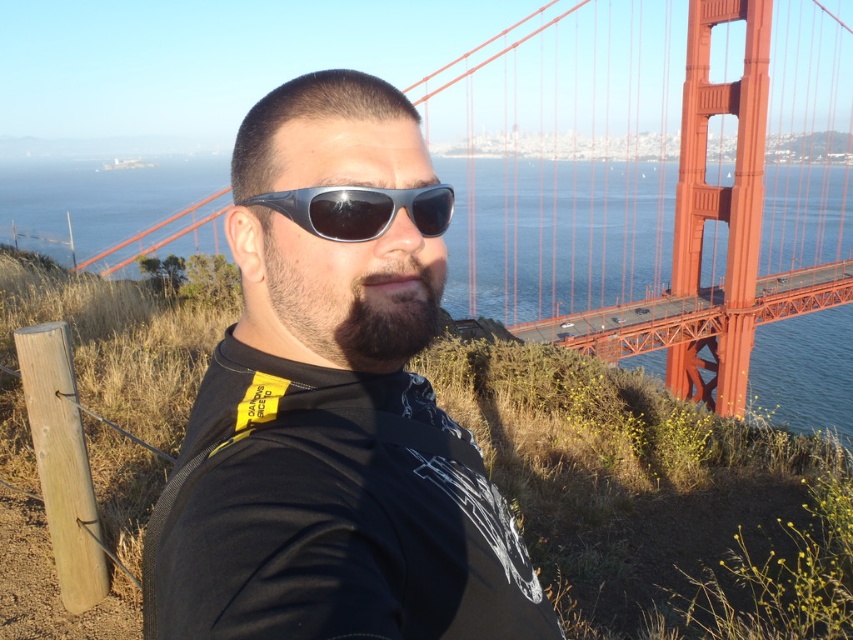
You are standing at the viewpoint of the Golden Gate Bridge and want to take a photo of the bridge. There is a point at coordinates point [334,404] on your camera screen. Where is this point located in the scene?

The point [334,404] is located on the black matte sunglasses at center.

You are trying to frame a photo of the black matte sunglasses at center so that it aligns with the Golden Gate Bridge in the background. Based on their positions, which direction should you move the sunglasses horizontally to better align with the bridge?

The black matte sunglasses at center is located at point 0.634 on the horizontal axis. To align it with the Golden Gate Bridge in the background, you should move it to the left since the bridge is centered at 0.5. However, since the exact coordinates of the bridge aren

You are a photographer who wants to capture the dark brown fuzzy beard at center and the red painted steel golden gate bridge at center in a single frame. Based on their positions, which object should you adjust your camera to focus on first to ensure both are in the frame?

The dark brown fuzzy beard at center is to the left of the red painted steel golden gate bridge at center, so you should focus on the dark brown fuzzy beard at center first to ensure both are in the frame.